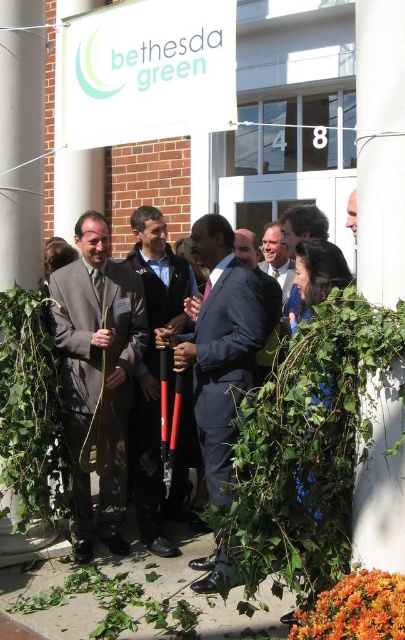
Looking at this image, can you confirm if orange matte flowers at lower right is smaller than dark blue suit at center?

Correct, orange matte flowers at lower right occupies less space than dark blue suit at center.

Is orange matte flowers at lower right shorter than dark blue suit at center?

Yes, orange matte flowers at lower right is shorter than dark blue suit at center.

Is point (385, 600) closer to viewer compared to point (259, 355)?

Yes, it is in front of point (259, 355).

Locate an element on the screen. The width and height of the screenshot is (405, 640). orange matte flowers at lower right is located at coordinates (355, 609).

Who is positioned more to the left, matte gray suit at center or black rubber tool at center?

From the viewer's perspective, matte gray suit at center appears more on the left side.

What do you see at coordinates (98, 371) in the screenshot? The width and height of the screenshot is (405, 640). I see `matte gray suit at center` at bounding box center [98, 371].

Locate an element on the screen. matte gray suit at center is located at coordinates (98, 371).

Where is `navy blue suit at center`? The height and width of the screenshot is (640, 405). navy blue suit at center is located at coordinates (219, 346).

Is navy blue suit at center positioned in front of orange matte flowers at lower right?

No, it is behind orange matte flowers at lower right.

Does point (204, 582) come behind point (400, 589)?

Yes, point (204, 582) is farther from viewer.

You are a GUI agent. You are given a task and a screenshot of the screen. Output one action in this format:
    pyautogui.click(x=<x>, y=<y>)
    Task: Click on the navy blue suit at center
    Image resolution: width=405 pixels, height=640 pixels.
    Given the screenshot: What is the action you would take?
    pyautogui.click(x=219, y=346)